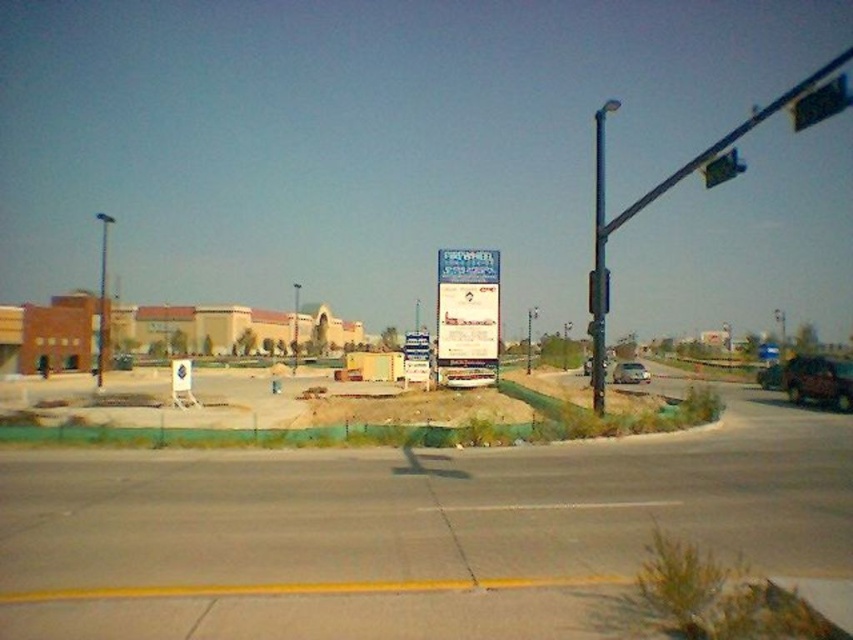
Which is in front, point (833, 371) or point (607, 364)?

Point (833, 371) is in front.

Who is higher up, metallic red suv at right or metallic silver sedan at center?

Positioned higher is metallic red suv at right.

I want to click on metallic red suv at right, so click(x=819, y=380).

Can you confirm if green metallic pole at center is wider than metallic silver sedan at center?

Yes, green metallic pole at center is wider than metallic silver sedan at center.

At what (x,y) coordinates should I click in order to perform the action: click on green metallic pole at center. Please return your answer as a coordinate pair (x, y). The image size is (853, 640). Looking at the image, I should click on (529, 337).

What are the coordinates of `green metallic pole at center` in the screenshot? It's located at (529, 337).

Does metallic pole at left have a lesser height compared to silver metallic sedan at center?

Incorrect, metallic pole at left's height does not fall short of silver metallic sedan at center's.

Who is shorter, metallic pole at left or silver metallic sedan at center?

silver metallic sedan at center is shorter.

Is point (105, 225) closer to viewer compared to point (621, 376)?

No, it is not.

At what (x,y) coordinates should I click in order to perform the action: click on metallic pole at left. Please return your answer as a coordinate pair (x, y). Looking at the image, I should click on (102, 298).